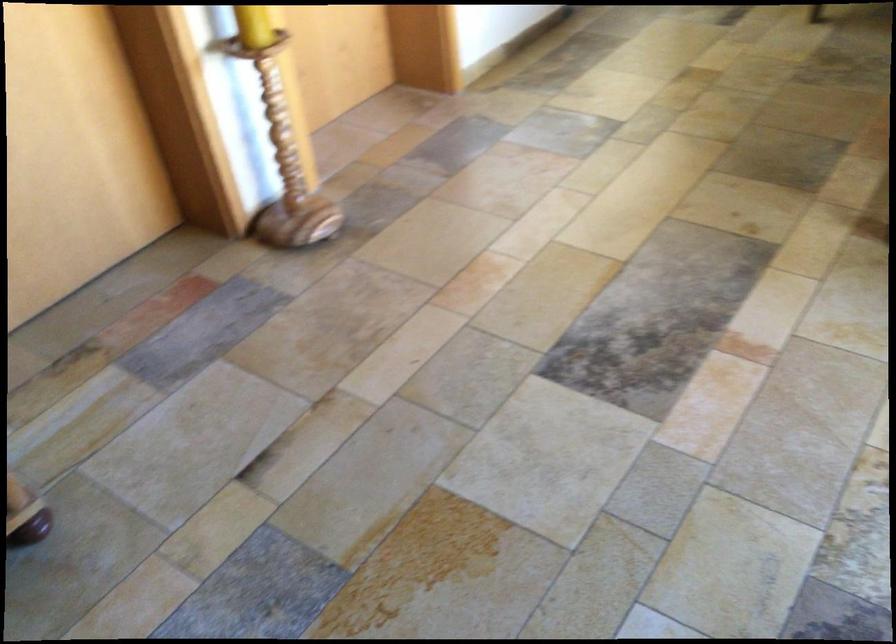
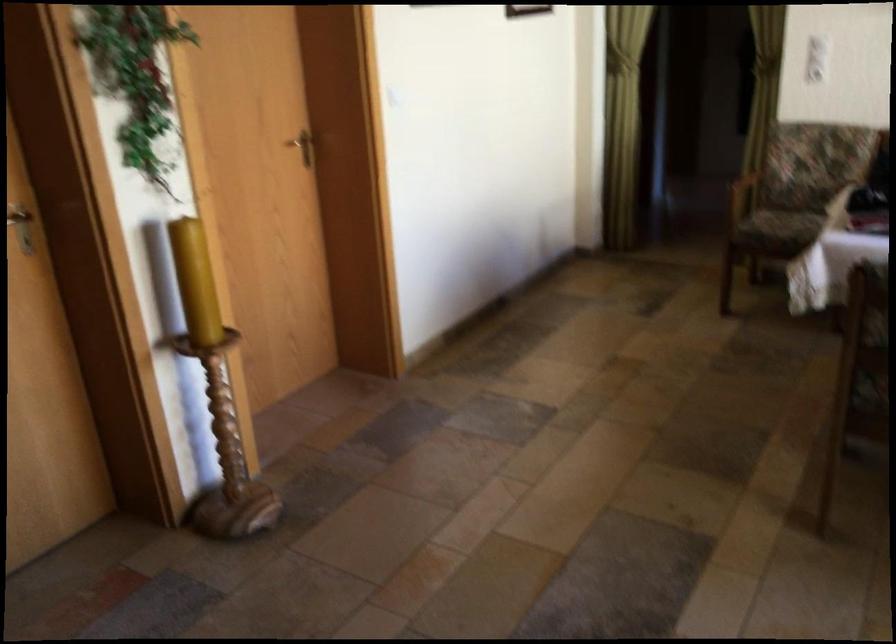
Question: Based on the continuous images, in which direction is the camera rotating? Reply with the corresponding letter.

Choices:
 (A) Left
 (B) Right
 (C) Up
 (D) Down

Answer: (C)